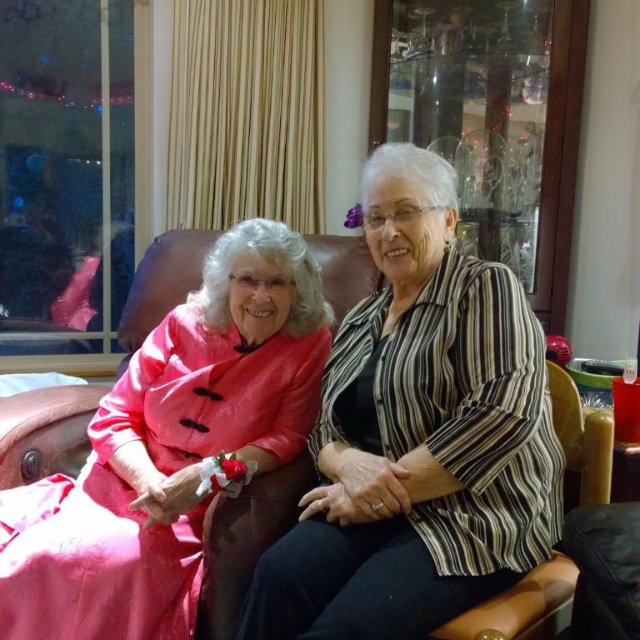
Can you confirm if striped fabric shirt at center is smaller than matte pink dress at left?

Indeed, striped fabric shirt at center has a smaller size compared to matte pink dress at left.

Between striped fabric shirt at center and matte pink dress at left, which one has less height?

With less height is matte pink dress at left.

Locate an element on the screen. This screenshot has width=640, height=640. striped fabric shirt at center is located at coordinates (419, 435).